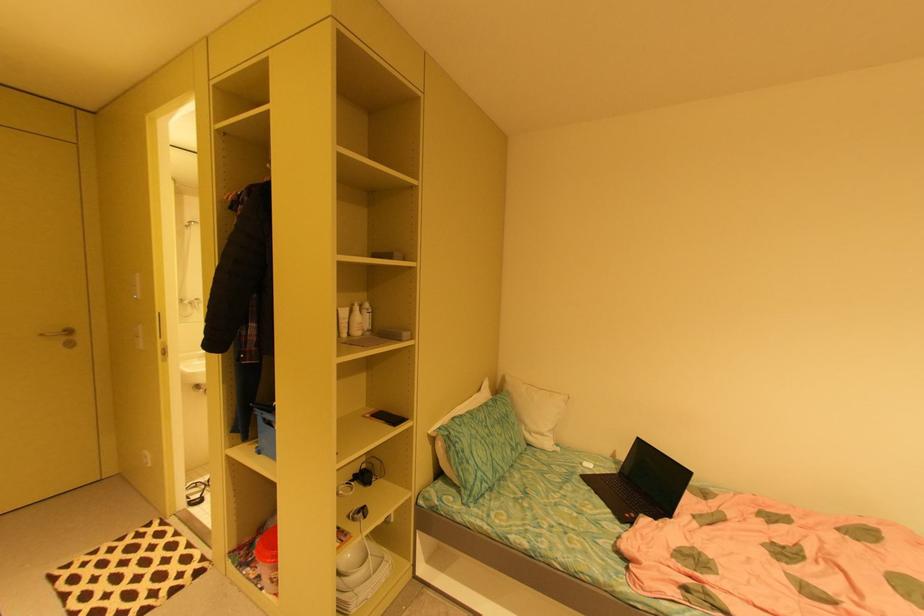
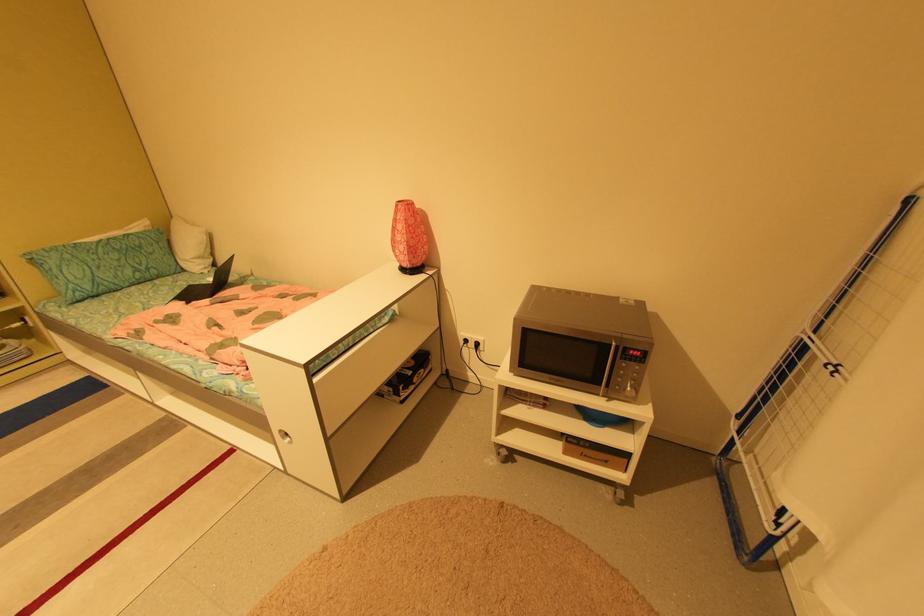
Locate, in the second image, the point that corresponds to (x=594, y=472) in the first image.

(210, 284)